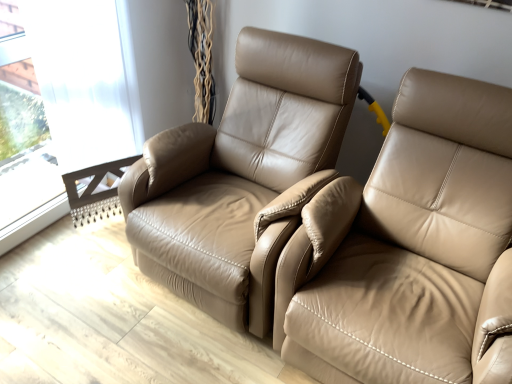
Locate an element on the screen. tan leather chair at center is located at coordinates (239, 175).

What do you see at coordinates (239, 175) in the screenshot?
I see `tan leather chair at center` at bounding box center [239, 175].

This screenshot has width=512, height=384. Identify the location of tan leather chair at center. (239, 175).

Identify the location of window that appears above the tan leather chair at center (from the image's perspective). The height and width of the screenshot is (384, 512). (69, 113).

Is point (51, 78) more distant than point (186, 258)?

Yes, point (51, 78) is farther from viewer.

Is transparent glass window at upper left far away from tan leather chair at center?

No, transparent glass window at upper left is not far away from tan leather chair at center.

Could you tell me if transparent glass window at upper left is facing tan leather chair at center?

Yes, transparent glass window at upper left is aimed at tan leather chair at center.

Based on the photo, choose the correct answer: Is beige leather recliner at right inside transparent glass window at upper left or outside it?

beige leather recliner at right is not inside transparent glass window at upper left, it's outside.

Would you say beige leather recliner at right is a long distance from transparent glass window at upper left?

Yes, beige leather recliner at right is far from transparent glass window at upper left.

Considering the positions of objects beige leather recliner at right and transparent glass window at upper left in the image provided, who is in front, beige leather recliner at right or transparent glass window at upper left?

beige leather recliner at right is in front.

From the picture: From a real-world perspective, which is physically above, beige leather recliner at right or transparent glass window at upper left?

transparent glass window at upper left.

Is tan leather chair at center situated inside beige leather recliner at right or outside?

tan leather chair at center is not inside beige leather recliner at right, it's outside.

Is tan leather chair at center facing away from beige leather recliner at right?

tan leather chair at center is not turned away from beige leather recliner at right.

Looking at their sizes, would you say tan leather chair at center is wider or thinner than beige leather recliner at right?

tan leather chair at center is thinner than beige leather recliner at right.

Based on their sizes in the image, would you say tan leather chair at center is bigger or smaller than beige leather recliner at right?

In the image, tan leather chair at center appears to be smaller than beige leather recliner at right.

From a real-world perspective, is beige leather recliner at right physically below tan leather chair at center?

Yes, from a real-world perspective, beige leather recliner at right is below tan leather chair at center.

Which object is closer to the camera taking this photo, beige leather recliner at right or tan leather chair at center?

beige leather recliner at right is more forward.

Is beige leather recliner at right at the right side of tan leather chair at center?

Yes.

Could you tell me if beige leather recliner at right is turned towards tan leather chair at center?

No, beige leather recliner at right does not turn towards tan leather chair at center.

Is point (51, 94) in front of point (416, 174)?

No, (51, 94) is further to viewer.

Who is bigger, transparent glass window at upper left or beige leather recliner at right?

With larger size is beige leather recliner at right.

From the image's perspective, which is above, transparent glass window at upper left or beige leather recliner at right?

transparent glass window at upper left is shown above in the image.

Would you say transparent glass window at upper left is outside beige leather recliner at right?

Yes.

Consider the image. Is tan leather chair at center bigger than transparent glass window at upper left?

Correct, tan leather chair at center is larger in size than transparent glass window at upper left.

How distant is tan leather chair at center from transparent glass window at upper left?

tan leather chair at center and transparent glass window at upper left are 25.45 inches apart.

Would you say tan leather chair at center contains transparent glass window at upper left?

No, transparent glass window at upper left is located outside of tan leather chair at center.

Does tan leather chair at center have a greater height compared to transparent glass window at upper left?

Incorrect, the height of tan leather chair at center is not larger of that of transparent glass window at upper left.

Identify the location of chair lying on the right of transparent glass window at upper left. (239, 175).

This screenshot has width=512, height=384. What are the coordinates of `window lying behind the beige leather recliner at right` in the screenshot? It's located at (69, 113).

Which object lies nearer to the anchor point tan leather chair at center, beige leather recliner at right or transparent glass window at upper left?

beige leather recliner at right is positioned closer to the anchor tan leather chair at center.

Considering their positions, is transparent glass window at upper left positioned closer to beige leather recliner at right than tan leather chair at center?

Among the two, tan leather chair at center is located nearer to beige leather recliner at right.

Looking at the image, which one is located closer to tan leather chair at center, transparent glass window at upper left or beige leather recliner at right?

beige leather recliner at right is closer to tan leather chair at center.

When comparing their distances from beige leather recliner at right, does tan leather chair at center or transparent glass window at upper left seem further?

Based on the image, transparent glass window at upper left appears to be further to beige leather recliner at right.

When comparing their distances from transparent glass window at upper left, does tan leather chair at center or beige leather recliner at right seem further?

beige leather recliner at right is positioned further to the anchor transparent glass window at upper left.

Looking at the image, which one is located further to transparent glass window at upper left, beige leather recliner at right or tan leather chair at center?

Among the two, beige leather recliner at right is located further to transparent glass window at upper left.

Find the location of `chair between transparent glass window at upper left and beige leather recliner at right in the horizontal direction`. chair between transparent glass window at upper left and beige leather recliner at right in the horizontal direction is located at coordinates pos(239,175).